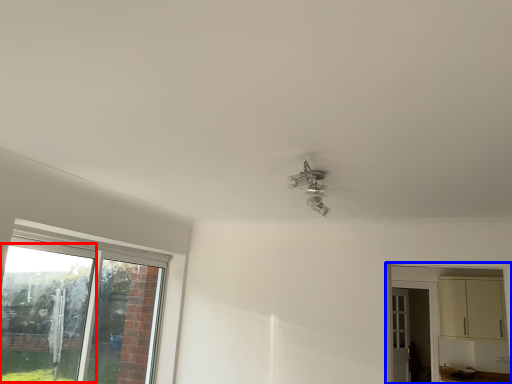
Question: Which object appears farthest to the camera in this image, window screen (highlighted by a red box) or dresser (highlighted by a blue box)?

Choices:
 (A) window screen
 (B) dresser

Answer: (B)